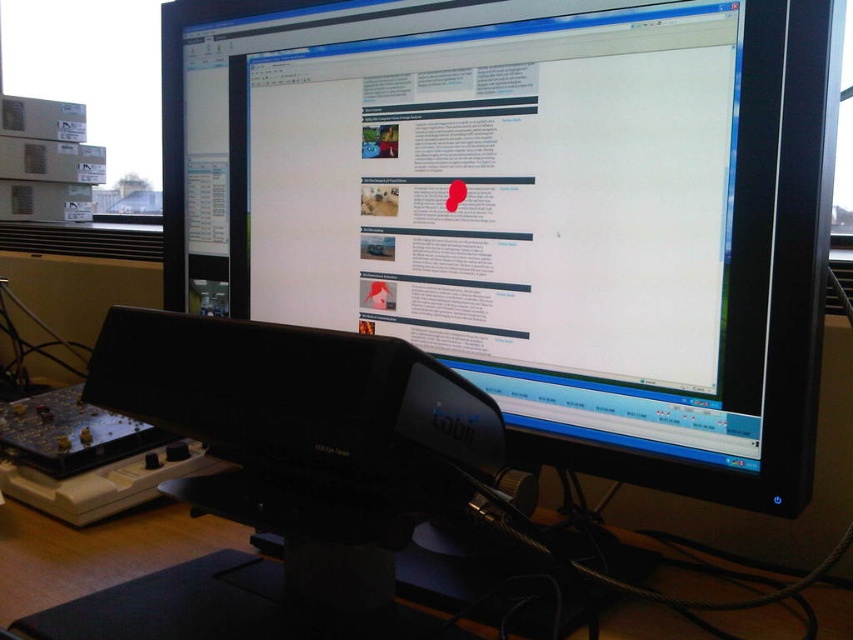
You are setting up a new desk and want to place a cup between the matte black monitor at center and the black plastic tobii eye tracker at lower center. Based on their positions, where should you place the cup?

The matte black monitor at center is above the black plastic tobii eye tracker at lower center, so you should place the cup between them either below the matte black monitor at center and above the black plastic tobii eye tracker at lower center.

You are a photographer setting up for a product shoot. You need to position a camera so that the matte black monitor at center fills the frame without cropping. Given that the camera you are using has a minimum focusing distance of 22 inches, will you be able to achieve this setup?

The matte black monitor at center is 21.65 inches away from the camera. Since the minimum focusing distance of the camera is 22 inches, the camera cannot focus at 21.65 inches, so you will not be able to achieve the setup without moving the camera further back.

You are a graphic designer working on a project and need to adjust the position of the red digital marker on the webpage displayed on the matte black monitor at center. The current position of the marker is at point (x=544, y=227). If you want to move it 0.1 units to the right along the x axis, what will be the new coordinates?

Moving the red digital marker 0.1 units to the right along the x axis from point (x=544, y=227) would result in new coordinates of 0.455, 0.639.